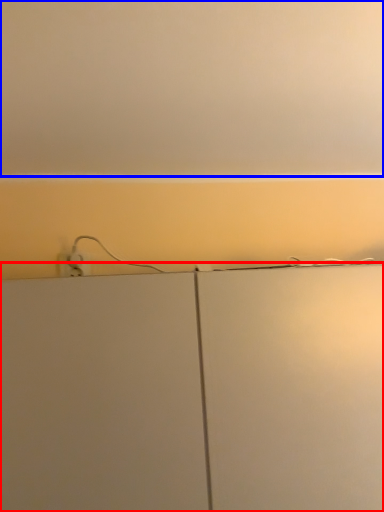
Question: Which object appears farthest to the camera in this image, cabinetry (highlighted by a red box) or backdrop (highlighted by a blue box)?

Choices:
 (A) cabinetry
 (B) backdrop

Answer: (A)